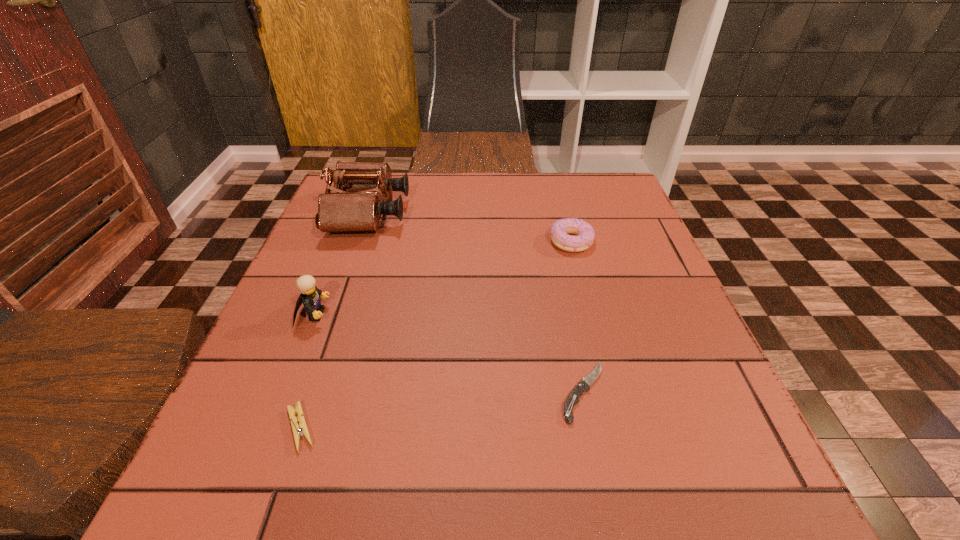
The image size is (960, 540). I want to click on free point that satisfies the following two spatial constraints: 1. on the front-facing side of the third farthest object; 2. on the right side of the clothespin, so click(269, 428).

Locate an element on the screen. The image size is (960, 540). vacant region that satisfies the following two spatial constraints: 1. on the front-facing side of the fourth shortest object; 2. on the left side of the pocketknife is located at coordinates (283, 392).

I want to click on free spot that satisfies the following two spatial constraints: 1. on the front-facing side of the third nearest object; 2. on the back side of the clothespin, so click(269, 428).

The width and height of the screenshot is (960, 540). What are the coordinates of `free location that satisfies the following two spatial constraints: 1. on the back side of the doughnut; 2. through the eyepieces of the tallest object` in the screenshot? It's located at (564, 214).

I want to click on vacant area that satisfies the following two spatial constraints: 1. on the front-facing side of the second tallest object; 2. on the back side of the clothespin, so click(x=269, y=428).

The width and height of the screenshot is (960, 540). Find the location of `vacant space that satisfies the following two spatial constraints: 1. through the eyepieces of the tallest object; 2. on the left side of the pocketknife`. vacant space that satisfies the following two spatial constraints: 1. through the eyepieces of the tallest object; 2. on the left side of the pocketknife is located at coordinates (306, 392).

Find the location of `free location that satisfies the following two spatial constraints: 1. through the eyepieces of the tallest object; 2. on the back side of the clothespin`. free location that satisfies the following two spatial constraints: 1. through the eyepieces of the tallest object; 2. on the back side of the clothespin is located at coordinates (294, 428).